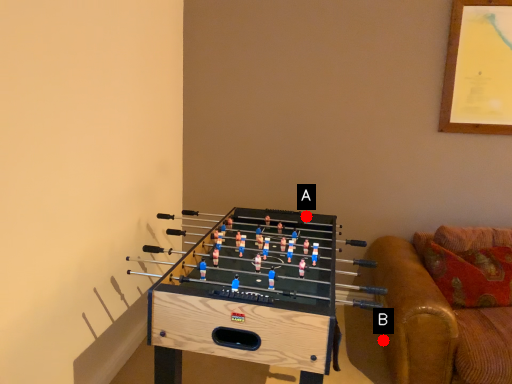
Question: Two points are circled on the image, labeled by A and B beside each circle. Which point appears farthest from the camera in this image?

Choices:
 (A) A is further
 (B) B is further

Answer: (B)